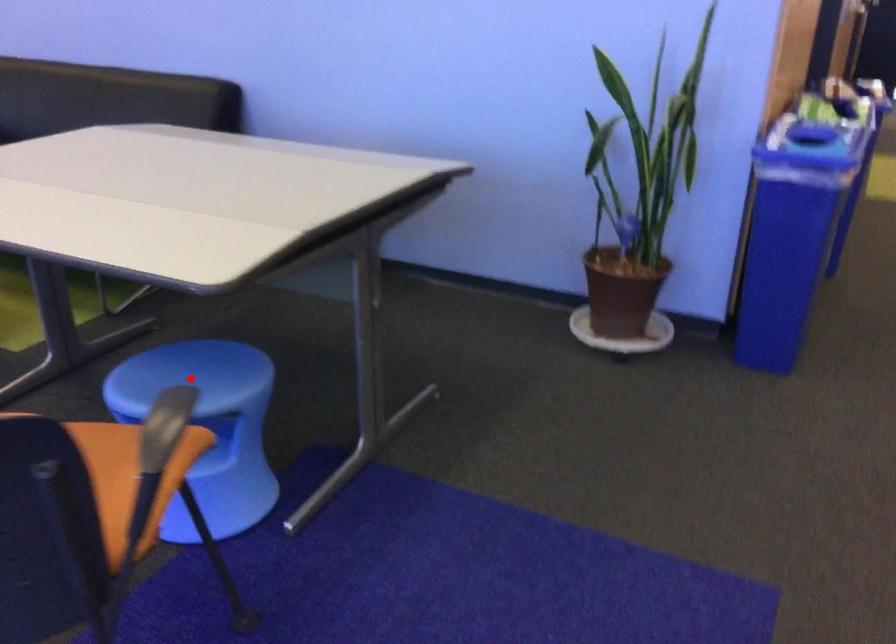
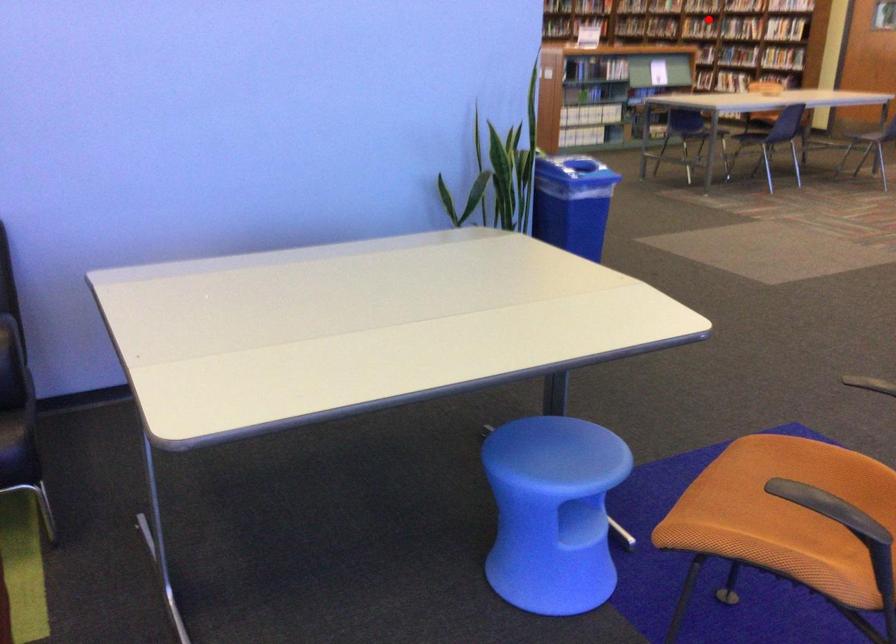
I am providing you with two images of the same scene from different viewpoints. A red point is marked on the first image and another point is marked on the second image. Is the marked point in image1 the same physical position as the marked point in image2?

No